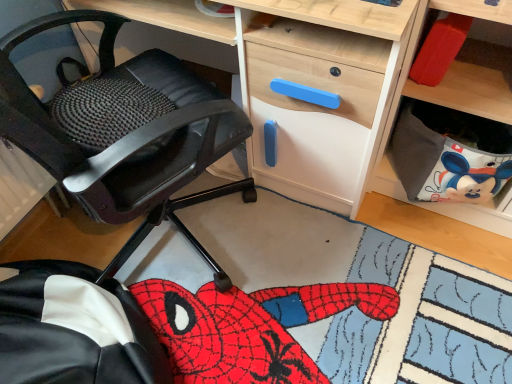
Question: Should I look upward or downward to see gray fabric bag at lower right?

Choices:
 (A) down
 (B) up

Answer: (B)

Question: Is gray fabric bag at lower right beside black leather chair at left?

Choices:
 (A) yes
 (B) no

Answer: (B)

Question: Is gray fabric bag at lower right oriented away from black leather chair at left?

Choices:
 (A) yes
 (B) no

Answer: (B)

Question: From a real-world perspective, is gray fabric bag at lower right located higher than black leather chair at left?

Choices:
 (A) no
 (B) yes

Answer: (A)

Question: Does gray fabric bag at lower right appear on the right side of black leather chair at left?

Choices:
 (A) no
 (B) yes

Answer: (B)

Question: Is gray fabric bag at lower right positioned in front of black leather chair at left?

Choices:
 (A) yes
 (B) no

Answer: (B)

Question: Can you confirm if gray fabric bag at lower right is bigger than black leather chair at left?

Choices:
 (A) no
 (B) yes

Answer: (A)

Question: Does black leather chair at left have a smaller size compared to gray fabric bag at lower right?

Choices:
 (A) no
 (B) yes

Answer: (A)

Question: From the image's perspective, would you say black leather chair at left is shown under gray fabric bag at lower right?

Choices:
 (A) yes
 (B) no

Answer: (B)

Question: Could you tell me if black leather chair at left is turned towards gray fabric bag at lower right?

Choices:
 (A) no
 (B) yes

Answer: (B)

Question: Is black leather chair at left positioned behind gray fabric bag at lower right?

Choices:
 (A) yes
 (B) no

Answer: (B)

Question: Would you consider black leather chair at left to be distant from gray fabric bag at lower right?

Choices:
 (A) no
 (B) yes

Answer: (A)

Question: Is black leather chair at left bigger than gray fabric bag at lower right?

Choices:
 (A) no
 (B) yes

Answer: (B)

Question: Is black leather chair at left thinner than wooden desk at center?

Choices:
 (A) no
 (B) yes

Answer: (A)